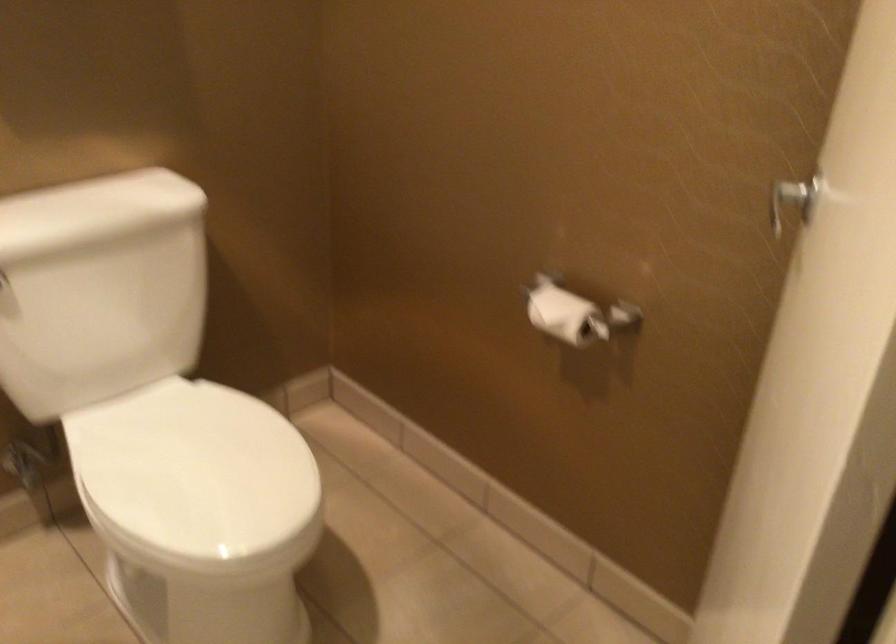
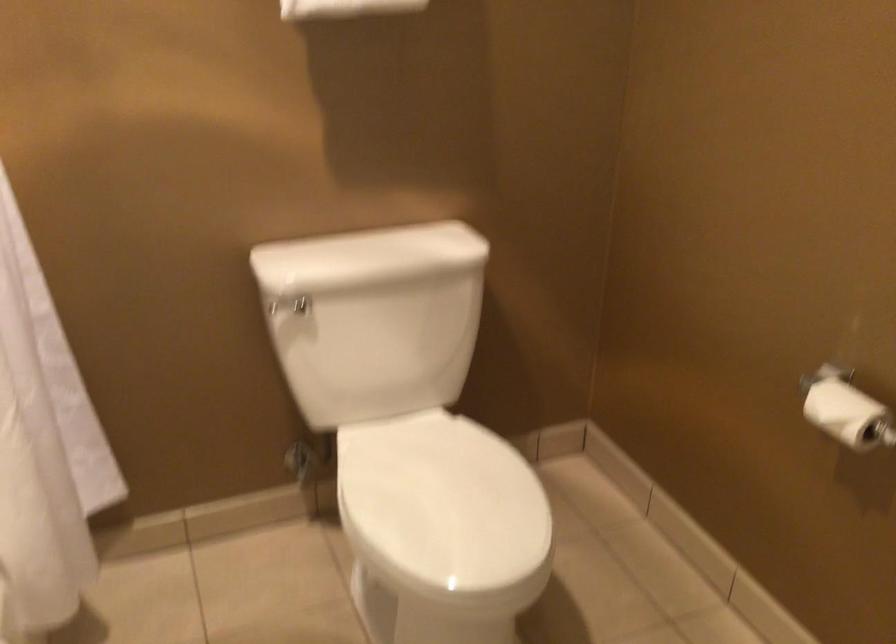
Find the pixel in the second image that matches the point at 202,469 in the first image.

(442, 505)